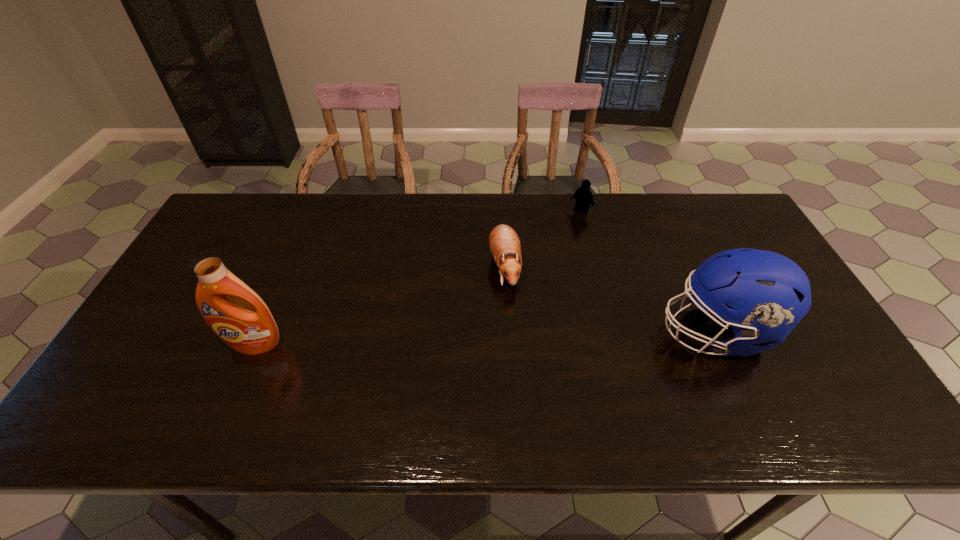
The height and width of the screenshot is (540, 960). In order to click on free space that satisfies the following two spatial constraints: 1. on the back side of the farthest object; 2. on the right side of the second farthest object in this screenshot , I will do `click(501, 211)`.